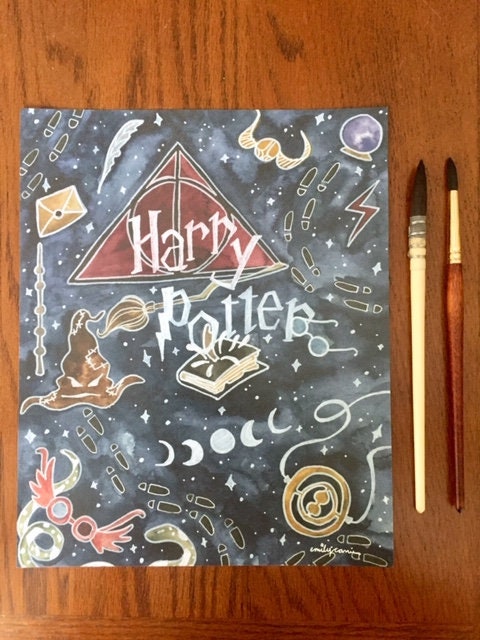
Where is `brown wooden table surface`? brown wooden table surface is located at coordinates (46, 602), (306, 618), (426, 566), (335, 24), (131, 45).